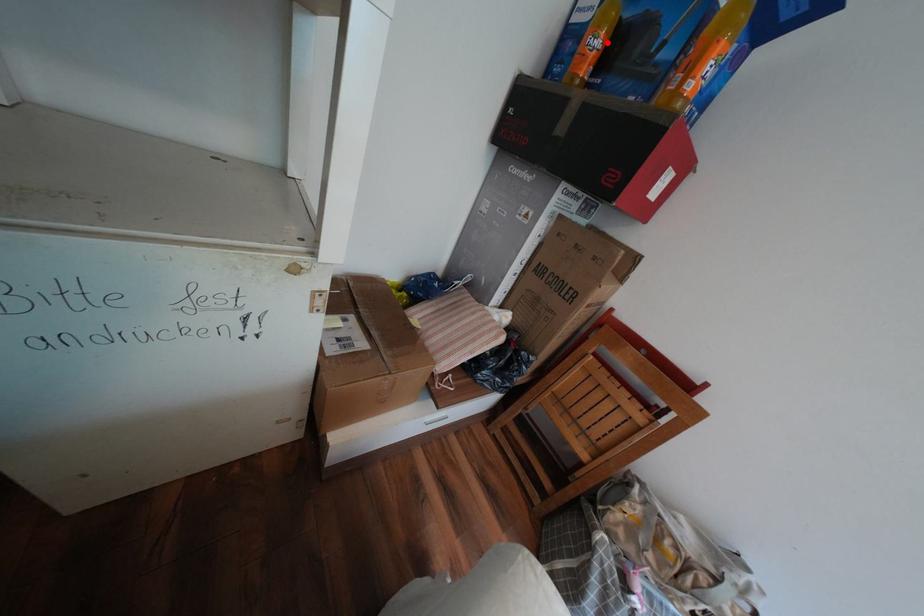
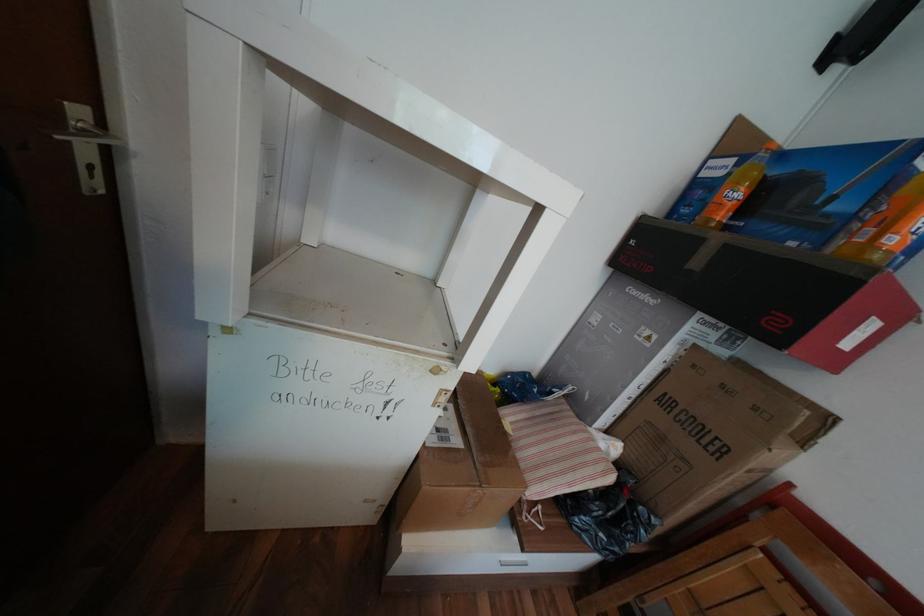
Find the pixel in the second image that matches the highlighted location in the first image.

(748, 195)